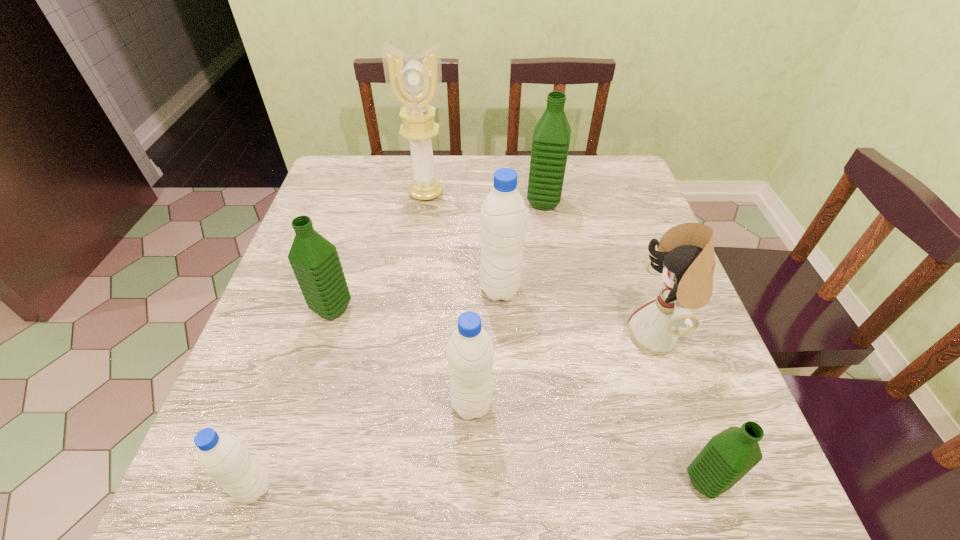
I want to click on the third closest gray water bottle relative to the tallest object, so click(222, 456).

Where is `gray water bottle that is the second closest to the third nearest water bottle`? The height and width of the screenshot is (540, 960). gray water bottle that is the second closest to the third nearest water bottle is located at coordinates (222, 456).

The image size is (960, 540). Find the location of `free space that satisfies the following two spatial constraints: 1. on the front side of the rightmost green water bottle; 2. on the right side of the second smallest green water bottle`. free space that satisfies the following two spatial constraints: 1. on the front side of the rightmost green water bottle; 2. on the right side of the second smallest green water bottle is located at coordinates (280, 482).

This screenshot has width=960, height=540. What are the coordinates of `vacant space that satisfies the following two spatial constraints: 1. on the front-facing side of the sixth object from right to left; 2. on the right side of the nearest green water bottle` in the screenshot? It's located at (384, 482).

Image resolution: width=960 pixels, height=540 pixels. I want to click on free space that satisfies the following two spatial constraints: 1. on the front-facing side of the tallest object; 2. on the left side of the farthest gray water bottle, so click(412, 289).